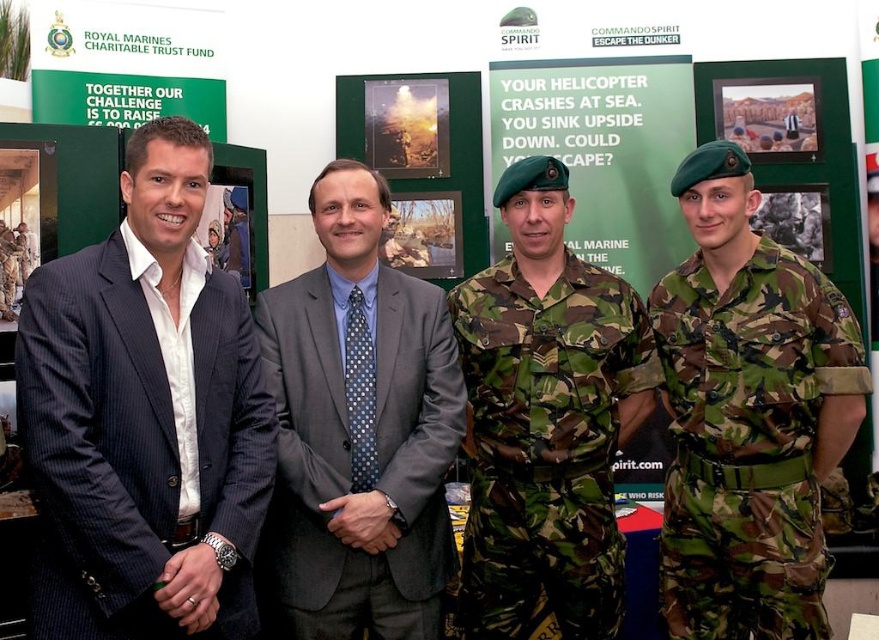
You are attending an indoor event where you see two men dressed in a dark blue pinstripe suit at left and a camouflage fabric uniform at center. Based on their attire, which one do you think is taller?

The dark blue pinstripe suit at left is taller than the camouflage fabric uniform at center.

In the scene shown: You are attending an event and want to approach the person in the dark blue pinstripe suit at left. Which direction should you move relative to the camouflage uniform at right?

You should move to the left of the camouflage uniform at right to reach the dark blue pinstripe suit at left, as the dark blue pinstripe suit at left is positioned to the left of the camouflage uniform at right.